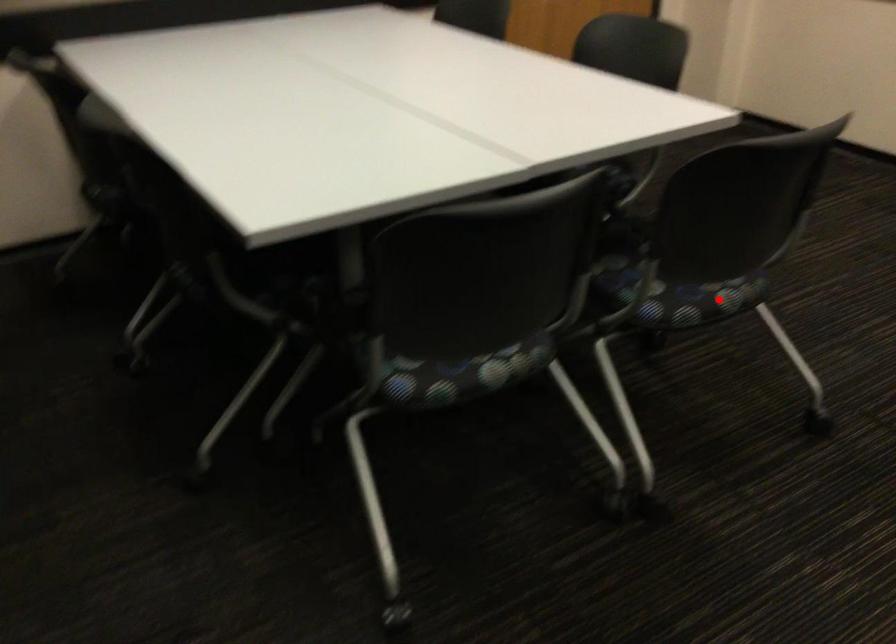
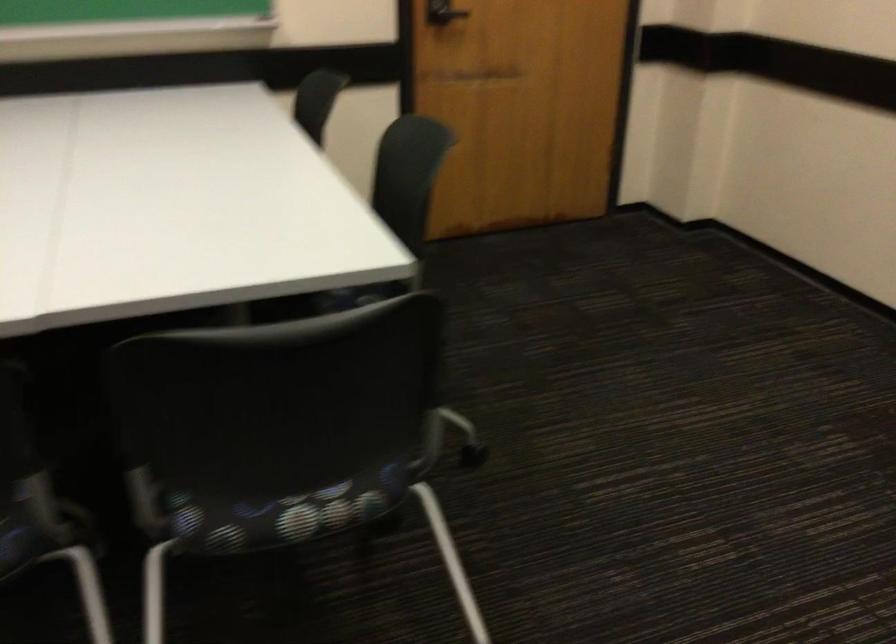
The point at the highlighted location is marked in the first image. Where is the corresponding point in the second image?

(286, 514)